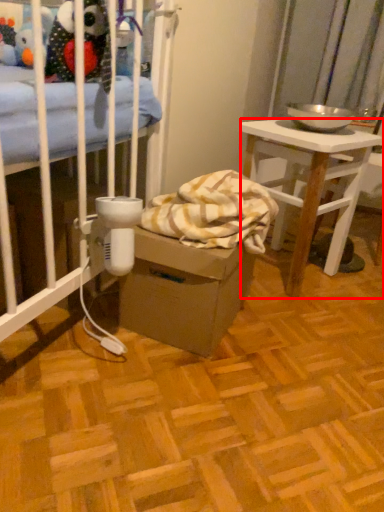
Question: From the image's perspective, what is the correct spatial relationship of desk (annotated by the red box) in relation to cardboard box?

Choices:
 (A) below
 (B) above

Answer: (B)